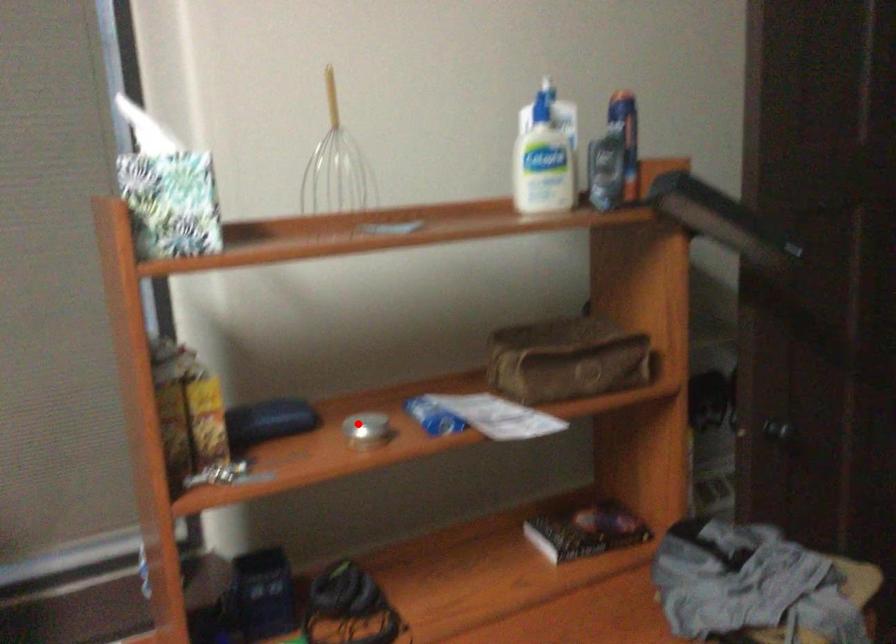
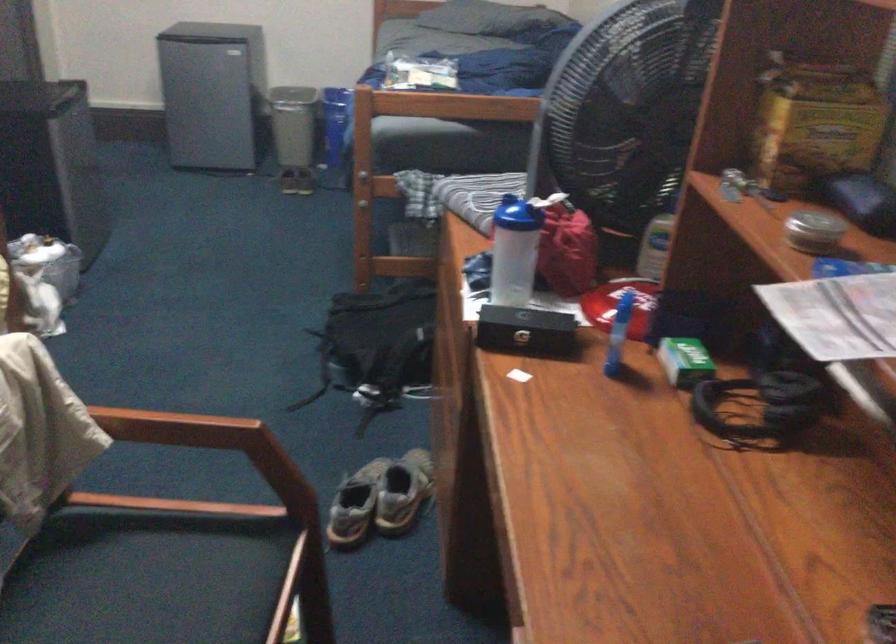
The point at the highlighted location is marked in the first image. Where is the corresponding point in the second image?

(814, 231)